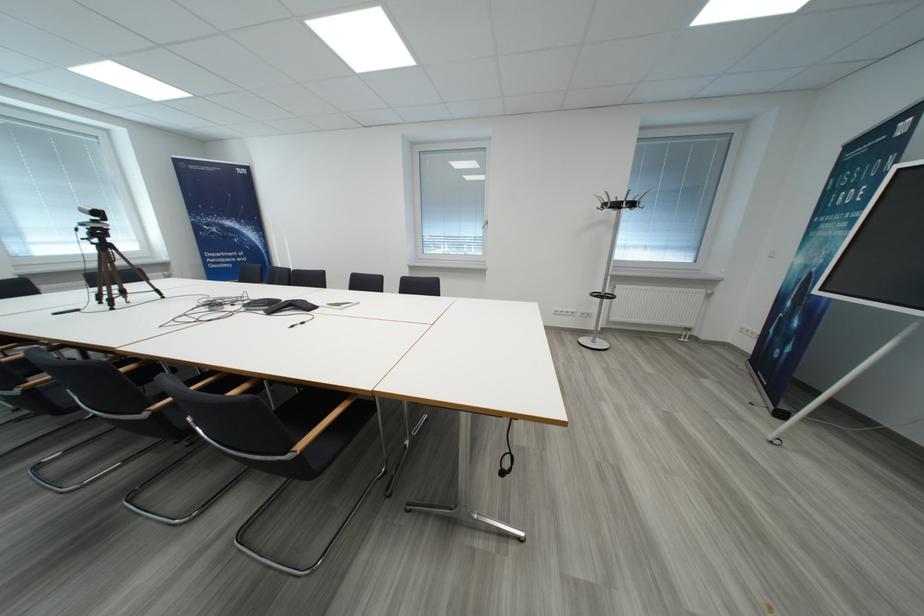
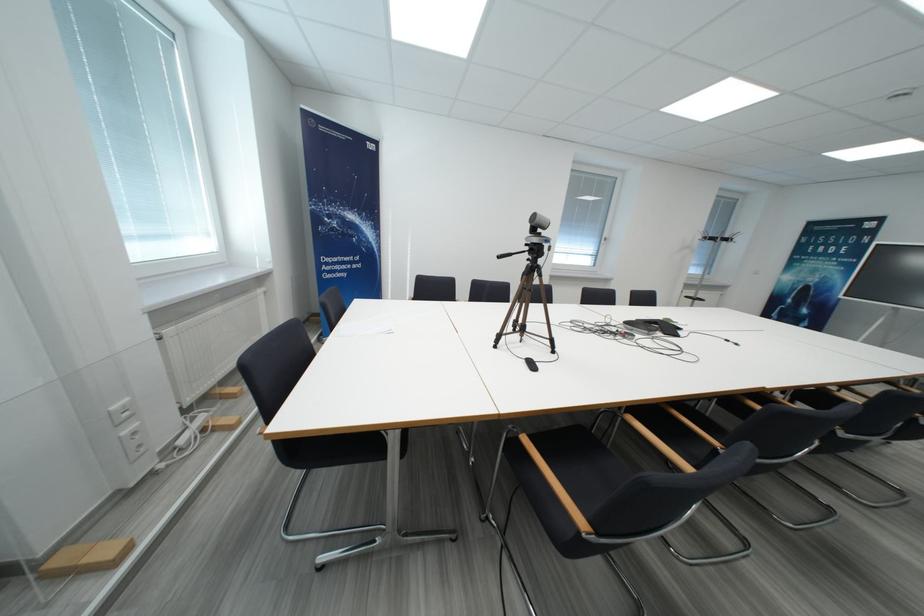
Question: Which direction would the cameraman need to move to produce the second image? Reply with the corresponding letter.

Choices:
 (A) Left
 (B) Right
 (C) Forward
 (D) Backward

Answer: (A)